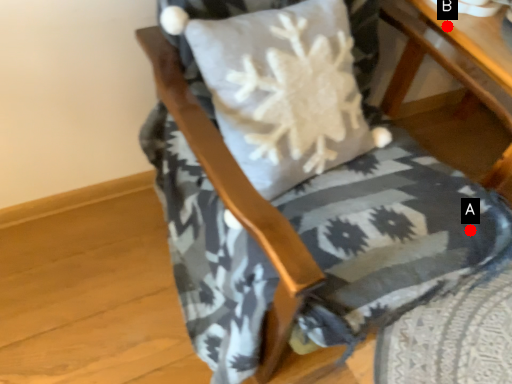
Question: Two points are circled on the image, labeled by A and B beside each circle. Among these points, which one is nearest to the camera?

Choices:
 (A) A is closer
 (B) B is closer

Answer: (A)